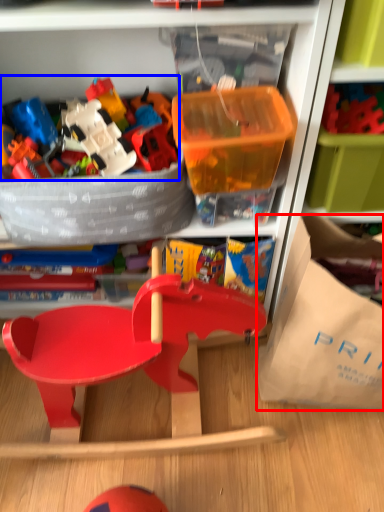
Question: Which point is further to the camera, paper bag (highlighted by a red box) or toy (highlighted by a blue box)?

Choices:
 (A) paper bag
 (B) toy

Answer: (B)